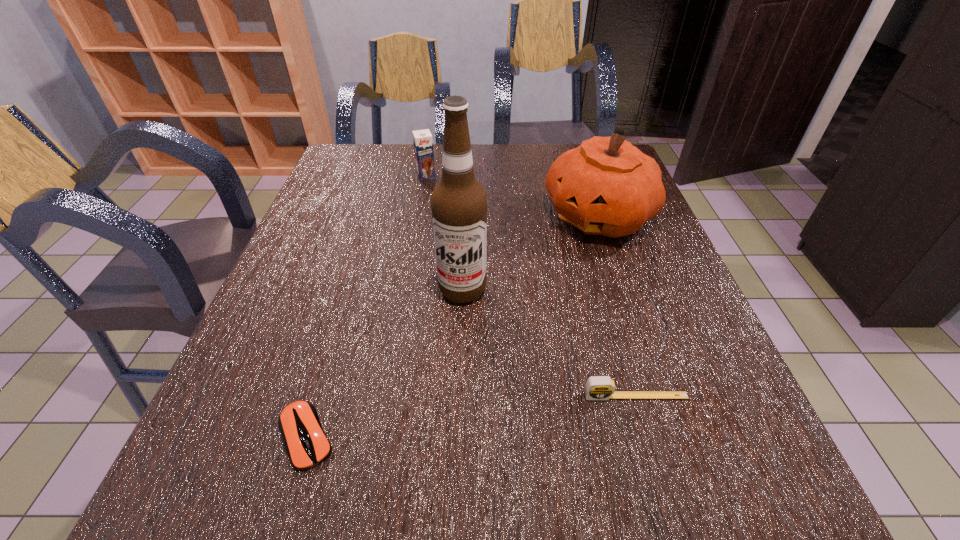
The image size is (960, 540). I want to click on free space located on the back of the nearest object, so click(x=326, y=371).

You are a GUI agent. You are given a task and a screenshot of the screen. Output one action in this format:
    pyautogui.click(x=<x>, y=<y>)
    Task: Click on the vacant space situated 0.240m on the front label of the third tallest object
    
    Given the screenshot: What is the action you would take?
    pyautogui.click(x=448, y=229)

Find the location of a particular element. free space located on the front label of the third tallest object is located at coordinates (452, 238).

You are a GUI agent. You are given a task and a screenshot of the screen. Output one action in this format:
    pyautogui.click(x=<x>, y=<y>)
    Task: Click on the vacant space located on the front label of the third tallest object
    This screenshot has width=960, height=540.
    Given the screenshot: What is the action you would take?
    pyautogui.click(x=448, y=229)

In order to click on vacant space located 0.290m on the label of the third object from left to right in this screenshot , I will do `click(433, 439)`.

Locate an element on the screen. vacant space situated on the label of the third object from left to right is located at coordinates (452, 341).

At what (x,y) coordinates should I click in order to perform the action: click on free space located 0.070m on the label of the third object from left to right. Please return your answer as a coordinate pair (x, y). This screenshot has width=960, height=540. Looking at the image, I should click on (454, 333).

You are a GUI agent. You are given a task and a screenshot of the screen. Output one action in this format:
    pyautogui.click(x=<x>, y=<y>)
    Task: Click on the free location located on the front-facing side of the fourth nearest object
    This screenshot has height=540, width=960.
    Given the screenshot: What is the action you would take?
    pyautogui.click(x=571, y=261)

Find the location of a particular element. This screenshot has width=960, height=540. free space located 0.200m on the front-facing side of the fourth nearest object is located at coordinates (547, 300).

Locate an element on the screen. vacant region located 0.320m on the front-facing side of the fourth nearest object is located at coordinates (523, 339).